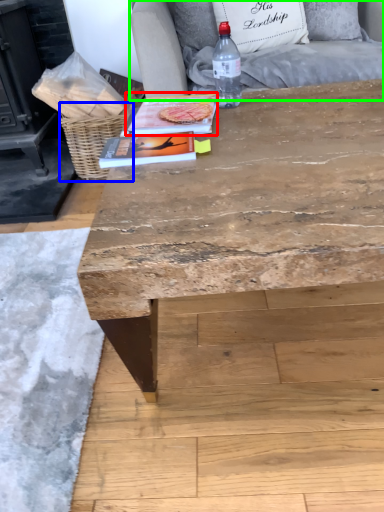
Question: Which is nearer to the magazine (highlighted by a red box)? basket (highlighted by a blue box) or armchair (highlighted by a green box).

Choices:
 (A) basket
 (B) armchair

Answer: (B)